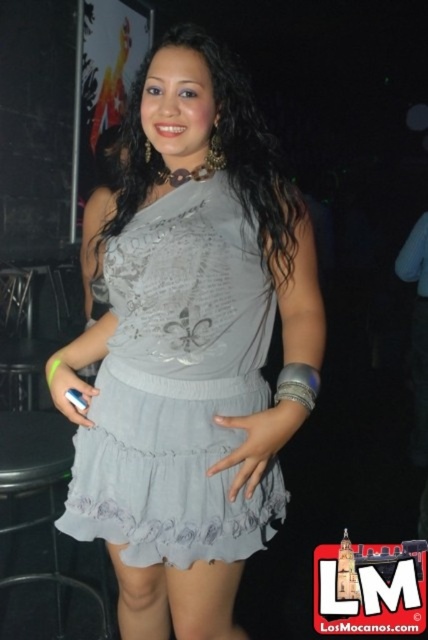
Consider the image. You are at a party and want to sit down. There is a black plastic bar stool at lower left. Can you sit on it?

Yes, you can sit on the black plastic bar stool at lower left because it is a seating option available at the specified location.

You are at a party and want to find the exact location of the neon green nail polish on the woman. According to the image, where would you look relative to the point at coordinates point (178, 387)?

The point at coordinates point (178, 387) is on the satin gray dress at center. The neon green nail polish is on the woman, but the provided information does not specify its exact location relative to the given point.